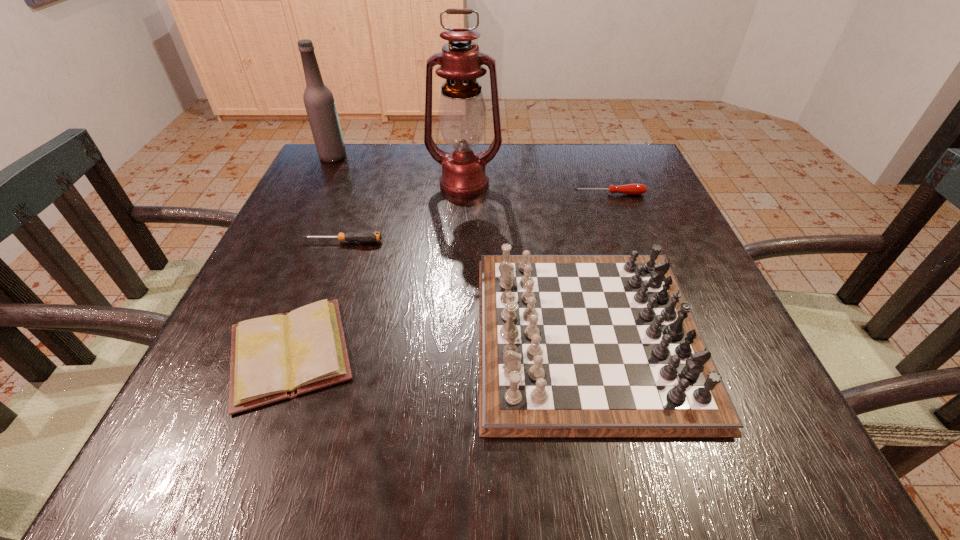
Where is `the tallest object`? the tallest object is located at coordinates (462, 114).

Locate an element on the screen. beer bottle is located at coordinates (319, 102).

Locate an element on the screen. the second tallest object is located at coordinates pyautogui.click(x=319, y=102).

Find the location of `chessboard`. chessboard is located at coordinates (569, 345).

Identify the location of the right screwdriver. (632, 189).

At what (x,y) coordinates should I click in order to perform the action: click on the left screwdriver. Please return your answer as a coordinate pair (x, y). Looking at the image, I should click on (363, 236).

Identify the location of the third nearest object. This screenshot has height=540, width=960. (363, 236).

Image resolution: width=960 pixels, height=540 pixels. I want to click on diary, so click(275, 357).

This screenshot has width=960, height=540. Find the location of `vacant region located 0.060m on the back of the oil lamp`. vacant region located 0.060m on the back of the oil lamp is located at coordinates (466, 159).

At what (x,y) coordinates should I click in order to perform the action: click on free spot located on the side of the farthest object with the label. Please return your answer as a coordinate pair (x, y). The width and height of the screenshot is (960, 540). Looking at the image, I should click on (387, 157).